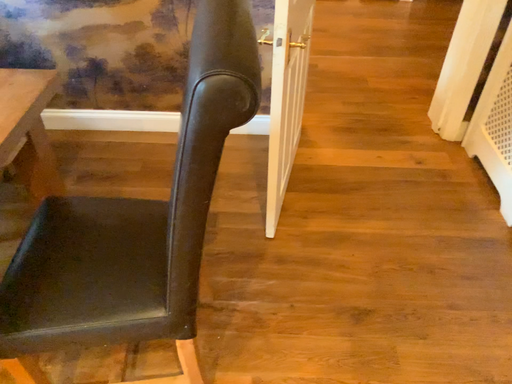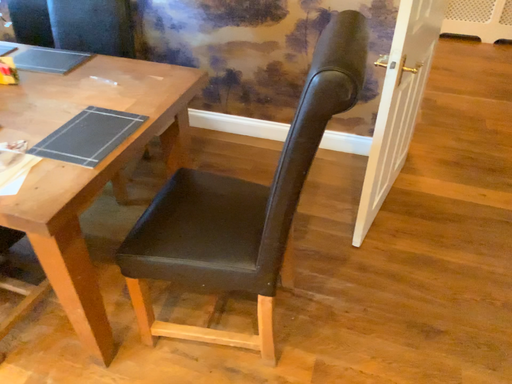
Question: How did the camera likely rotate when shooting the video?

Choices:
 (A) rotated left
 (B) rotated right

Answer: (A)